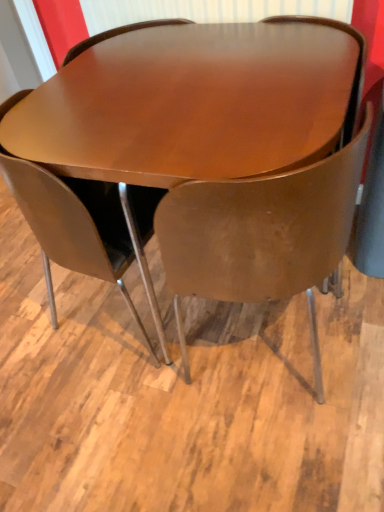
Question: From a real-world perspective, is matte brown chair at center, which ranks as the second chair in left-to-right order, physically above glossy wood table at center?

Choices:
 (A) yes
 (B) no

Answer: (A)

Question: Is matte brown chair at center, which ranks as the second chair in left-to-right order, to the left of glossy wood table at center from the viewer's perspective?

Choices:
 (A) yes
 (B) no

Answer: (B)

Question: Is matte brown chair at center, which ranks as the second chair in left-to-right order, taller than glossy wood table at center?

Choices:
 (A) yes
 (B) no

Answer: (A)

Question: Does matte brown chair at center, which ranks as the second chair in left-to-right order, have a lesser height compared to glossy wood table at center?

Choices:
 (A) yes
 (B) no

Answer: (B)

Question: Is the depth of matte brown chair at center, which ranks as the second chair in left-to-right order, greater than that of glossy wood table at center?

Choices:
 (A) no
 (B) yes

Answer: (A)

Question: Is glossy wood table at center at the back of matte brown chair at center, which ranks as the second chair in left-to-right order?

Choices:
 (A) yes
 (B) no

Answer: (A)

Question: Would you say glossy wood table at center is outside matte brown chair at center, the first chair in the right-to-left sequence?

Choices:
 (A) no
 (B) yes

Answer: (B)

Question: Is the surface of glossy wood table at center in direct contact with matte brown chair at center, which ranks as the second chair in left-to-right order?

Choices:
 (A) yes
 (B) no

Answer: (B)

Question: Does glossy wood table at center have a larger size compared to matte brown chair at center, the first chair in the right-to-left sequence?

Choices:
 (A) no
 (B) yes

Answer: (B)

Question: From the image's perspective, is glossy wood table at center above matte brown chair at center, the first chair in the right-to-left sequence?

Choices:
 (A) yes
 (B) no

Answer: (A)

Question: Is glossy wood table at center facing away from matte brown chair at center, the first chair in the right-to-left sequence?

Choices:
 (A) no
 (B) yes

Answer: (A)

Question: Considering the relative sizes of glossy wood table at center and matte brown chair at center, the first chair in the right-to-left sequence, in the image provided, is glossy wood table at center taller than matte brown chair at center, the first chair in the right-to-left sequence,?

Choices:
 (A) no
 (B) yes

Answer: (A)

Question: Can you confirm if matte brown chair at center, positioned as the 2th chair in right-to-left order, is shorter than glossy wood table at center?

Choices:
 (A) yes
 (B) no

Answer: (B)